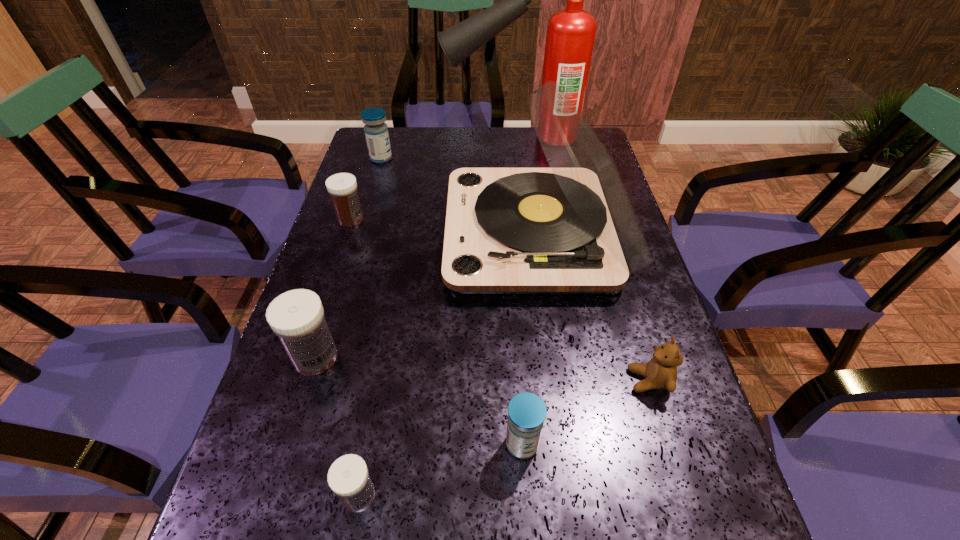
What are the coordinates of `the tallest object` in the screenshot? It's located at (570, 36).

The height and width of the screenshot is (540, 960). In order to click on the farthest object in this screenshot , I will do `click(570, 36)`.

This screenshot has height=540, width=960. Identify the location of the second tallest object. (569, 229).

Identify the location of the left blue medicine. (376, 131).

Locate an element on the screen. Image resolution: width=960 pixels, height=540 pixels. the bigger blue medicine is located at coordinates (376, 131).

Find the location of `the third farthest medicine`. the third farthest medicine is located at coordinates (297, 317).

Identify the location of the biggest white medicine. click(x=297, y=317).

Image resolution: width=960 pixels, height=540 pixels. Identify the location of the rightmost medicine. (526, 411).

The height and width of the screenshot is (540, 960). I want to click on the smaller blue medicine, so click(x=526, y=411).

The width and height of the screenshot is (960, 540). I want to click on the second smallest white medicine, so click(342, 187).